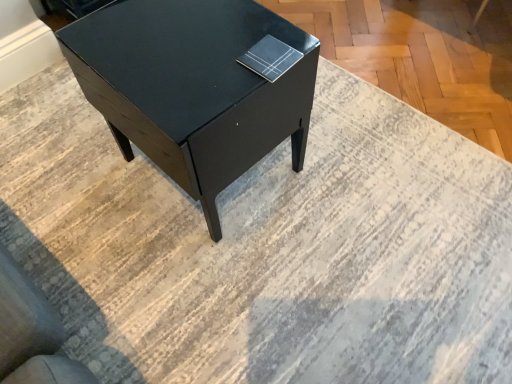
This screenshot has height=384, width=512. Find the location of `vacant point above matte black table at center (from a real-world perspective)`. vacant point above matte black table at center (from a real-world perspective) is located at coordinates (189, 38).